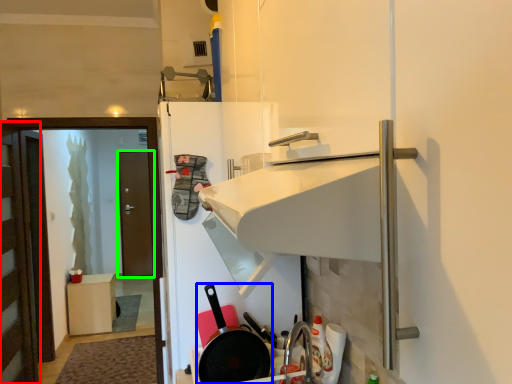
Question: Which object is positioned farthest from door (highlighted by a red box)? Select from frying pan (highlighted by a blue box) and door (highlighted by a green box).

Choices:
 (A) frying pan
 (B) door

Answer: (B)